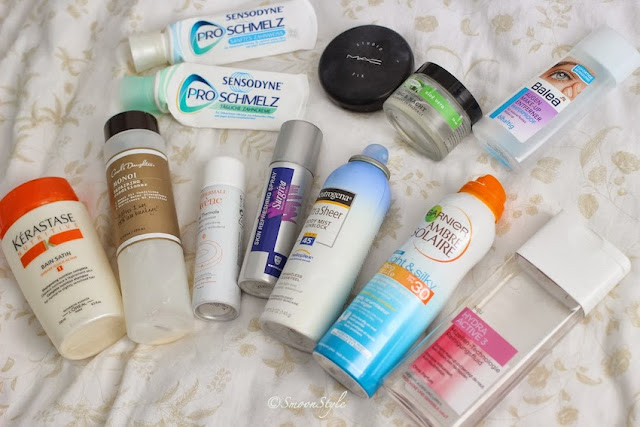
What are the coordinates of `bedsheet` in the screenshot? It's located at (528, 47).